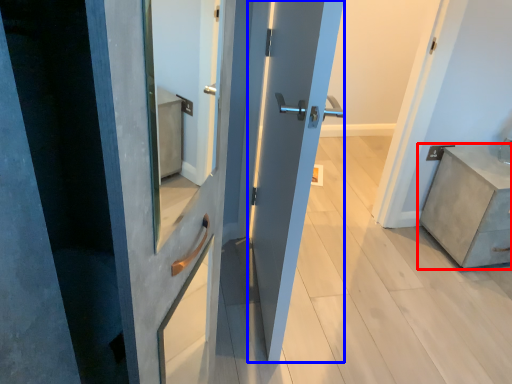
Question: Which object appears closest to the camera in this image, chest of drawers (highlighted by a red box) or door (highlighted by a blue box)?

Choices:
 (A) chest of drawers
 (B) door

Answer: (B)